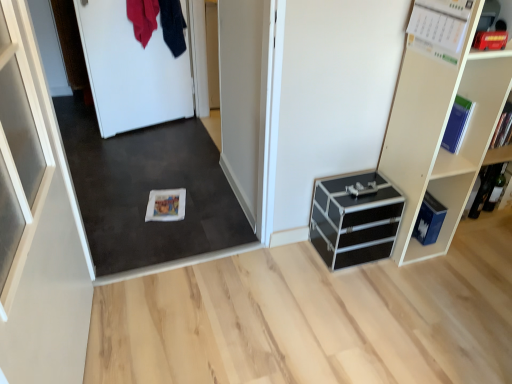
The height and width of the screenshot is (384, 512). What do you see at coordinates (131, 70) in the screenshot?
I see `white matte door at upper left` at bounding box center [131, 70].

In order to click on white matte book at center, which ranks as the first book in back-to-front order in this screenshot , I will do `click(166, 205)`.

In order to click on white paper calendar at upper right, placed as the 1th book when sorted from top to bottom in this screenshot , I will do `click(437, 28)`.

At what (x,y) coordinates should I click in order to perform the action: click on black metallic storage case at lower right. Please return your answer as a coordinate pair (x, y). This screenshot has height=384, width=512. Looking at the image, I should click on (429, 220).

From the image's perspective, is dark blue fabric at upper left, which is the second clothing in left-to-right order, located beneath white matte book at center, which ranks as the first book in back-to-front order?

No.

Consider the image. Who is smaller, dark blue fabric at upper left, marked as the 1th clothing in a right-to-left arrangement, or white matte book at center, the first book in the bottom-to-top sequence?

Smaller between the two is white matte book at center, the first book in the bottom-to-top sequence.

From a real-world perspective, who is located higher, dark blue fabric at upper left, marked as the 1th clothing in a right-to-left arrangement, or white matte book at center, which ranks as the first book in back-to-front order?

dark blue fabric at upper left, marked as the 1th clothing in a right-to-left arrangement, is physically above.

Which object is positioned more to the right, dark blue fabric at upper left, marked as the 1th clothing in a right-to-left arrangement, or white matte book at center, the fourth book when ordered from right to left?

white matte book at center, the fourth book when ordered from right to left.

Is matte white shelf at upper right completely or partially outside of hardcover book at right, arranged as the second book when ordered from the bottom?

Yes.

From a real-world perspective, is matte white shelf at upper right positioned above or below hardcover book at right, placed as the third book when sorted from top to bottom?

From a real-world perspective, matte white shelf at upper right is physically above hardcover book at right, placed as the third book when sorted from top to bottom.

Is matte white shelf at upper right directly adjacent to hardcover book at right, positioned as the 2th book in back-to-front order?

No, matte white shelf at upper right is not with hardcover book at right, positioned as the 2th book in back-to-front order.

How distant is white paper calendar at upper right, positioned as the first book in front-to-back order, from white matte book at center, which is counted as the fourth book, starting from the top?

They are 1.50 meters apart.

Considering the positions of objects white paper calendar at upper right, positioned as the first book in front-to-back order, and white matte book at center, which ranks as the first book in back-to-front order, in the image provided, who is in front, white paper calendar at upper right, positioned as the first book in front-to-back order, or white matte book at center, which ranks as the first book in back-to-front order,?

white paper calendar at upper right, positioned as the first book in front-to-back order, is more forward.

Looking at this image, considering the relative positions of white paper calendar at upper right, placed as the 3th book when sorted from right to left, and white matte book at center, the fourth book when ordered from right to left, in the image provided, is white paper calendar at upper right, placed as the 3th book when sorted from right to left, to the right of white matte book at center, the fourth book when ordered from right to left, from the viewer's perspective?

Yes, white paper calendar at upper right, placed as the 3th book when sorted from right to left, is to the right of white matte book at center, the fourth book when ordered from right to left.

Can you confirm if white paper calendar at upper right, placed as the 1th book when sorted from top to bottom, is thinner than white matte book at center, arranged as the 1th book when viewed from the left?

Indeed, white paper calendar at upper right, placed as the 1th book when sorted from top to bottom, has a lesser width compared to white matte book at center, arranged as the 1th book when viewed from the left.

From a real-world perspective, is matte white shelf at upper right over blue matte book at upper right, which is the 3th book from bottom to top?

Incorrect, from a real-world perspective, matte white shelf at upper right is lower than blue matte book at upper right, which is the 3th book from bottom to top.

Is point (471, 91) positioned before point (467, 112)?

Yes, point (471, 91) is in front of point (467, 112).

The image size is (512, 384). In order to click on book that is the 1st one above the matte white shelf at upper right (from a real-world perspective) in this screenshot , I will do `click(457, 124)`.

Between matte white shelf at upper right and blue matte book at upper right, the third book in the back-to-front sequence, which one appears on the left side from the viewer's perspective?

matte white shelf at upper right is more to the left.

From a real-world perspective, is white matte carpet at center above or below matte white shelf at upper right?

From a real-world perspective, white matte carpet at center is physically below matte white shelf at upper right.

Considering the relative sizes of white matte carpet at center and matte white shelf at upper right in the image provided, is white matte carpet at center thinner than matte white shelf at upper right?

Yes.

In the image, there is a matte white shelf at upper right. Identify the location of corridor below it (from a real-world perspective). Image resolution: width=512 pixels, height=384 pixels. (148, 193).

From a real-world perspective, between dark blue fabric at upper left, marked as the 1th clothing in a right-to-left arrangement, and white matte carpet at center, who is vertically higher?

dark blue fabric at upper left, marked as the 1th clothing in a right-to-left arrangement.

From the image's perspective, which object appears higher, dark blue fabric at upper left, which is the second clothing in left-to-right order, or white matte carpet at center?

dark blue fabric at upper left, which is the second clothing in left-to-right order.

Does dark blue fabric at upper left, marked as the 1th clothing in a right-to-left arrangement, turn towards white matte carpet at center?

No, dark blue fabric at upper left, marked as the 1th clothing in a right-to-left arrangement, is not turned towards white matte carpet at center.

Between black metallic storage case at lower right and matte white shelf at upper right, which one has larger size?

matte white shelf at upper right is bigger.

Looking at this image, who is shorter, black metallic storage case at lower right or matte white shelf at upper right?

black metallic storage case at lower right is shorter.

Is black metallic storage case at lower right turned away from matte white shelf at upper right?

Yes, black metallic storage case at lower right is facing away from matte white shelf at upper right.

Considering the points (419, 240) and (449, 198), which point is in front, point (419, 240) or point (449, 198)?

The point (449, 198) is closer to the camera.

From a real-world perspective, count 1st clothings upward from the white matte book at center, which is the fourth book from front to back, and point to it. Please provide its 2D coordinates.

[(173, 26)]

Locate an element on the screen. Image resolution: width=512 pixels, height=384 pixels. the 1st book positioned below the matte white shelf at upper right (from a real-world perspective) is located at coordinates (486, 187).

Estimate the real-world distances between objects in this image. Which object is closer to velvet-like red cloth at upper left, the second clothing in the right-to-left sequence, black metallic storage case at lower right or black aluminum chest of drawers at lower right?

black aluminum chest of drawers at lower right.

When comparing their distances from white matte door at upper left, does white matte carpet at center or hardcover book at right, arranged as the second book when ordered from the bottom, seem closer?

white matte carpet at center.

From the image, which object appears to be nearer to white matte carpet at center, black metallic storage case at lower right or white paper calendar at upper right, arranged as the fourth book when viewed from the back?

black metallic storage case at lower right is closer to white matte carpet at center.

Considering their positions, is white paper calendar at upper right, arranged as the fourth book when viewed from the back, positioned closer to blue matte book at upper right, which ranks as the third book in left-to-right order, than hardcover book at right, positioned as the 2th book in back-to-front order?

Among the two, white paper calendar at upper right, arranged as the fourth book when viewed from the back, is located nearer to blue matte book at upper right, which ranks as the third book in left-to-right order.

Looking at the image, which one is located further to blue matte book at upper right, which appears as the second book when viewed from the right, dark blue fabric at upper left, marked as the 1th clothing in a right-to-left arrangement, or velvet-like red cloth at upper left, the second clothing in the right-to-left sequence?

velvet-like red cloth at upper left, the second clothing in the right-to-left sequence.

From the image, which object appears to be farther from black metallic storage case at lower right, black aluminum chest of drawers at lower right or white matte book at center, the first book in the bottom-to-top sequence?

white matte book at center, the first book in the bottom-to-top sequence, lies further to black metallic storage case at lower right than the other object.

Considering their positions, is white matte door at upper left positioned closer to black metallic storage case at lower right than white matte book at center, which is counted as the fourth book, starting from the top?

white matte book at center, which is counted as the fourth book, starting from the top.

From the image, which object appears to be nearer to black metallic storage case at lower right, matte white shelf at upper right or white matte door at upper left?

The object closer to black metallic storage case at lower right is matte white shelf at upper right.

You are a GUI agent. You are given a task and a screenshot of the screen. Output one action in this format:
    pyautogui.click(x=<x>, y=<y>)
    Task: Click on the shelf between dark blue fabric at upper left, marked as the 1th clothing in a right-to-left arrangement, and blue matte book at upper right, which appears as the second book when viewed from the right
    The height and width of the screenshot is (384, 512).
    Given the screenshot: What is the action you would take?
    pyautogui.click(x=441, y=133)

Locate an element on the screen. The width and height of the screenshot is (512, 384). chest of drawers between velvet-like red cloth at upper left, the second clothing in the right-to-left sequence, and black metallic storage case at lower right from left to right is located at coordinates (355, 219).

Identify the location of chest of drawers between white matte door at upper left and black metallic storage case at lower right. The height and width of the screenshot is (384, 512). (355, 219).

This screenshot has height=384, width=512. Identify the location of corridor between white matte door at upper left and matte white shelf at upper right. (148, 193).